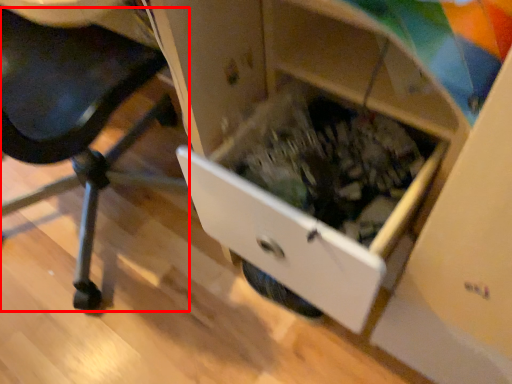
Question: From the image's perspective, where is furniture (annotated by the red box) located in relation to drawer in the image?

Choices:
 (A) below
 (B) above

Answer: (B)